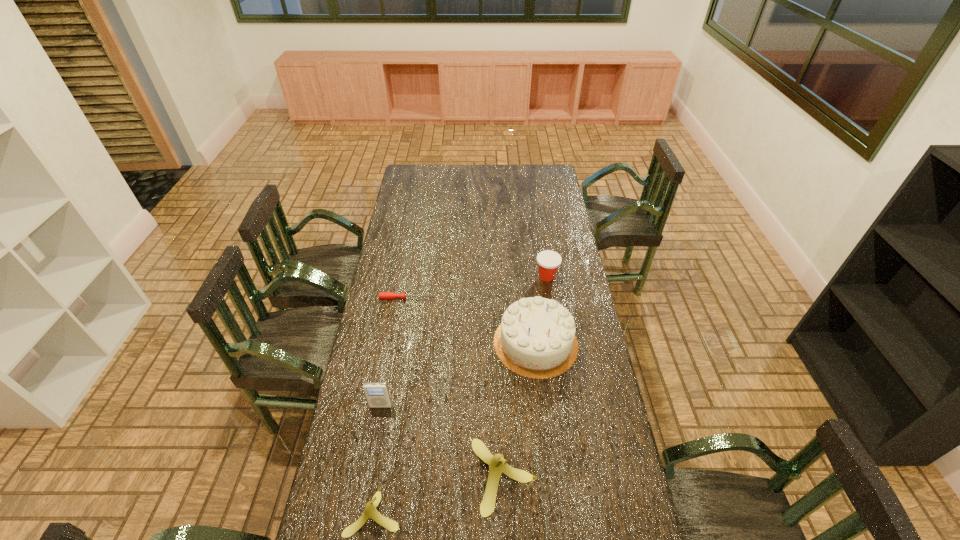
Find the location of a particular element. The width and height of the screenshot is (960, 540). the shorter banana is located at coordinates (370, 511).

Locate an element on the screen. the right banana is located at coordinates (497, 464).

Identify the location of the farthest object. (548, 261).

You are a GUI agent. You are given a task and a screenshot of the screen. Output one action in this format:
    pyautogui.click(x=<x>, y=<y>)
    Task: Click on the shortest object
    This screenshot has width=960, height=540.
    Given the screenshot: What is the action you would take?
    pyautogui.click(x=382, y=295)

The height and width of the screenshot is (540, 960). I want to click on screwdriver, so click(x=382, y=295).

Locate an element on the screen. The image size is (960, 540). the fourth nearest object is located at coordinates (536, 338).

Locate an element on the screen. This screenshot has height=540, width=960. iPod is located at coordinates (377, 394).

Locate an element on the screen. The width and height of the screenshot is (960, 540). free space located on the right of the left banana is located at coordinates (500, 512).

This screenshot has width=960, height=540. Find the location of `free space located on the back of the right banana`. free space located on the back of the right banana is located at coordinates (501, 391).

At what (x,y) coordinates should I click in order to perform the action: click on vacant space located 0.140m on the back of the farthest object. Please return your answer as a coordinate pair (x, y). Looking at the image, I should click on (542, 249).